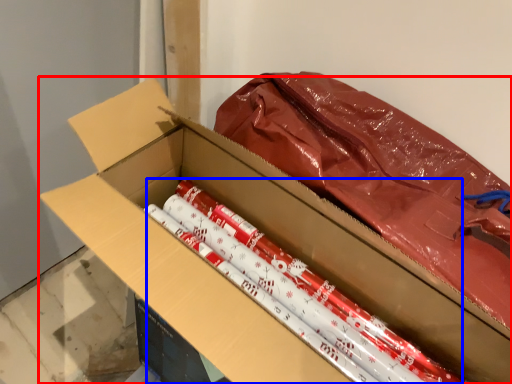
Question: Which of the following is the farthest to the observer, box (highlighted by a red box) or crayon (highlighted by a blue box)?

Choices:
 (A) box
 (B) crayon

Answer: (B)